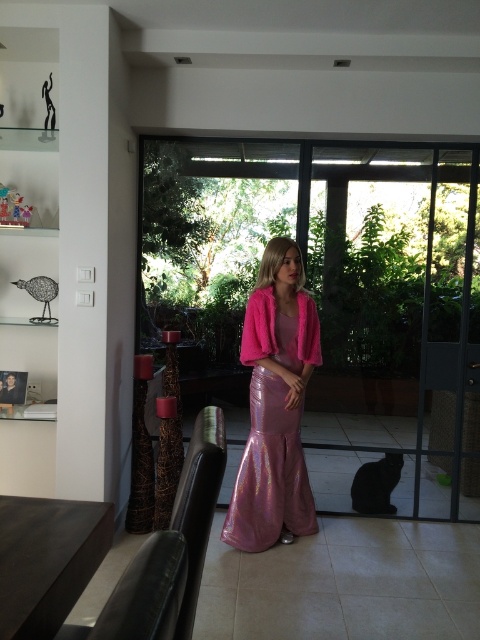
Question: Does transparent glass door at center appear on the right side of shiny pink dress at center?

Choices:
 (A) no
 (B) yes

Answer: (B)

Question: Among these objects, which one is farthest from the camera?

Choices:
 (A) transparent glass door at center
 (B) shiny pink dress at center

Answer: (A)

Question: Which of the following is the farthest from the observer?

Choices:
 (A) shiny pink dress at center
 (B) transparent glass door at center

Answer: (B)

Question: Is transparent glass door at center wider than shiny pink dress at center?

Choices:
 (A) no
 (B) yes

Answer: (B)

Question: Which point is farther to the camera?

Choices:
 (A) (275, 348)
 (B) (464, 234)

Answer: (B)

Question: Is transparent glass door at center bigger than shiny pink dress at center?

Choices:
 (A) no
 (B) yes

Answer: (B)